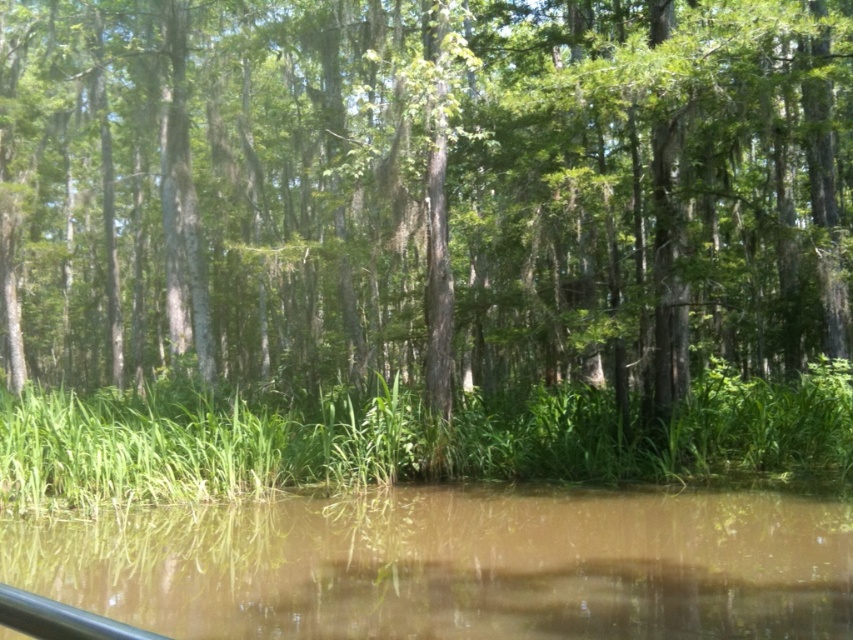
You are on a boat navigating through a swamp. You notice a green matte tree at center and a black rubber rail at lower left. Which object would appear closer to you from the boat?

The green matte tree at center appears closer to you because it is larger in size compared to the black rubber rail at lower left, indicating it is nearer due to perspective.

You are navigating a small boat through the swamp and notice two points marked on your map. The first point is at coordinate point(97, 253) and the second is at point(282, 627). According to the image, which point is closer to the dense forest of tall trees in the background?

Point(97, 253) is behind point(282, 627), so it is closer to the dense forest of tall trees in the background.